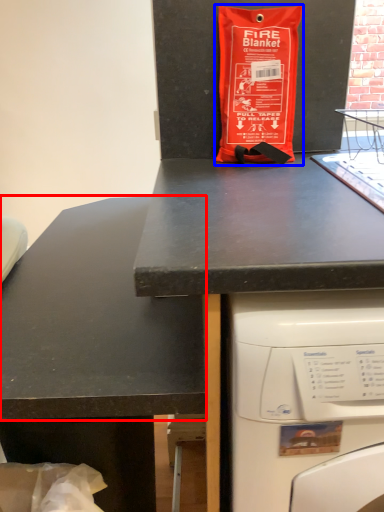
Question: Among these objects, which one is nearest to the camera, counter top (highlighted by a red box) or bag (highlighted by a blue box)?

Choices:
 (A) counter top
 (B) bag

Answer: (A)